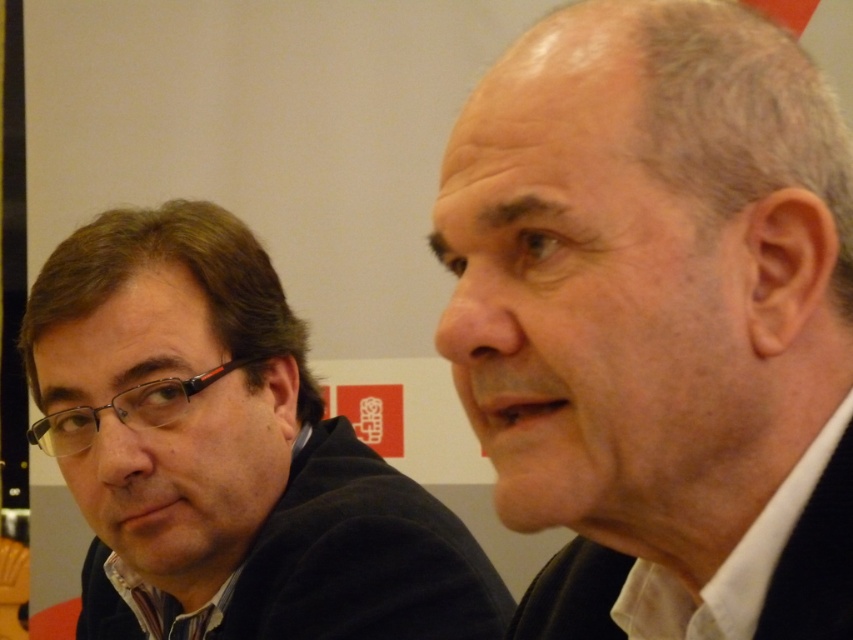
You are an assistant who needs to determine the spatial relationship between the white matte suit at center and the dark brown hair at left in the image. Based on the scene, which object is closer to the viewer?

The white matte suit at center is closer to the viewer than the dark brown hair at left because it is positioned in front of it.

You are a fashion designer evaluating two items in a photo. You see the white matte suit at center and the dark brown hair at left. Which item takes up more visual space in the image?

The dark brown hair at left takes up more visual space than the white matte suit at center because it is larger in size according to the description.